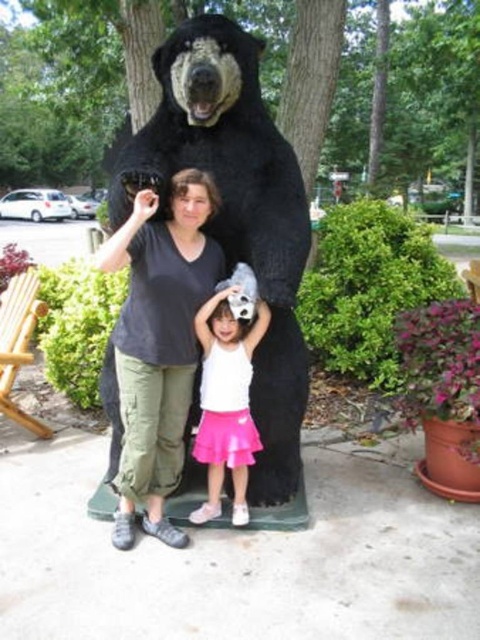
Who is more forward, (225, 58) or (169, 236)?

Point (225, 58)

Is point (205, 131) less distant than point (165, 458)?

Yes, it is.

This screenshot has height=640, width=480. I want to click on black furry bear at center, so coord(235,211).

Based on the photo, between black furry bear at center and pink satin skirt at lower center, which one has less height?

Standing shorter between the two is pink satin skirt at lower center.

Can you confirm if black furry bear at center is thinner than pink satin skirt at lower center?

No.

Where is `black furry bear at center`? The height and width of the screenshot is (640, 480). black furry bear at center is located at coordinates (235, 211).

Is point (220, 269) positioned behind point (239, 499)?

That is False.

What do you see at coordinates (158, 342) in the screenshot? I see `dark gray t-shirt at center` at bounding box center [158, 342].

Between point (176, 248) and point (229, 426), which one is positioned behind?

Point (229, 426)

This screenshot has width=480, height=640. What are the coordinates of `dark gray t-shirt at center` in the screenshot? It's located at (158, 342).